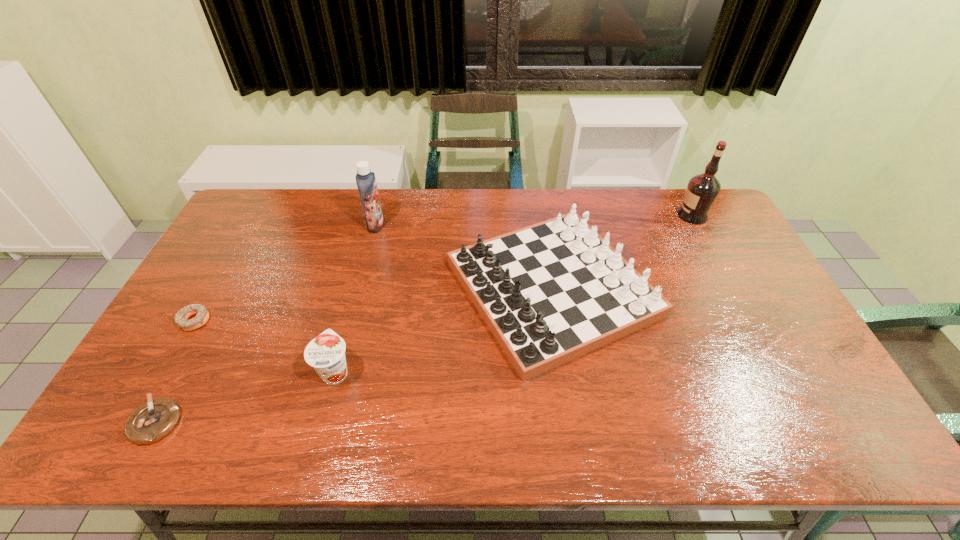
The height and width of the screenshot is (540, 960). What are the coordinates of `liquor` in the screenshot? It's located at (702, 190).

This screenshot has height=540, width=960. I want to click on the rightmost object, so click(x=702, y=190).

Locate an element on the screen. the second tallest object is located at coordinates (365, 179).

This screenshot has height=540, width=960. Identify the location of the fifth object from left to right. (551, 292).

You are a GUI agent. You are given a task and a screenshot of the screen. Output one action in this format:
    pyautogui.click(x=<x>, y=<y>)
    Task: Click on the third tallest object
    The height and width of the screenshot is (540, 960).
    Given the screenshot: What is the action you would take?
    pyautogui.click(x=551, y=292)

Where is `yogurt`? The height and width of the screenshot is (540, 960). yogurt is located at coordinates (326, 353).

You are a GUI agent. You are given a task and a screenshot of the screen. Output one action in this format:
    pyautogui.click(x=<x>, y=<y>)
    Task: Click on the doughnut
    Image resolution: width=960 pixels, height=540 pixels.
    Given the screenshot: What is the action you would take?
    pyautogui.click(x=202, y=312)

Where is `the nearest object`? the nearest object is located at coordinates (156, 418).

Identify the location of vacant point located 0.310m on the surface of the tallest object. The width and height of the screenshot is (960, 540). (590, 215).

The height and width of the screenshot is (540, 960). I want to click on vacant area situated on the surface of the tallest object, so click(633, 215).